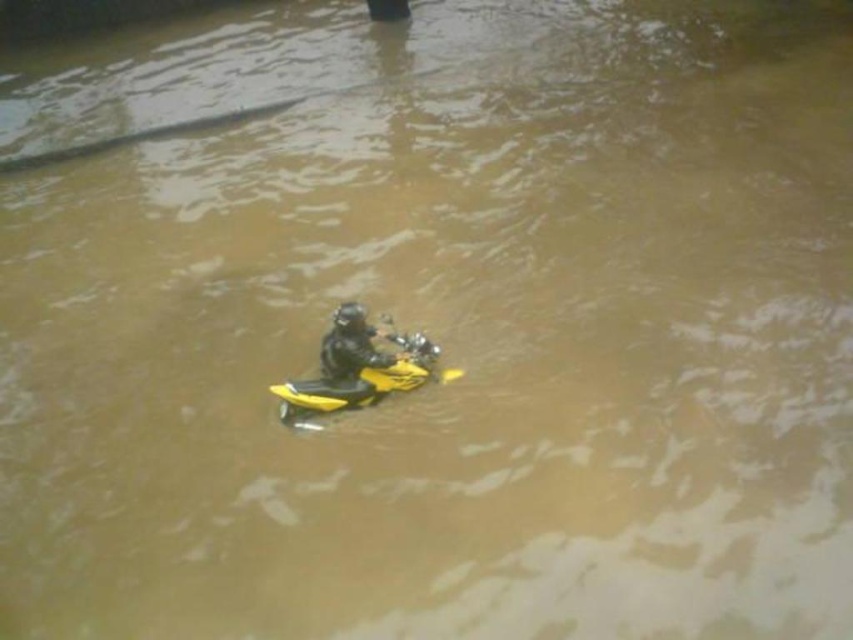
Question: Is the position of yellow matte motorcycle at center less distant than that of black matte helmet at center?

Choices:
 (A) yes
 (B) no

Answer: (B)

Question: Does yellow matte motorcycle at center appear on the right side of black matte helmet at center?

Choices:
 (A) yes
 (B) no

Answer: (A)

Question: Which point is closer to the camera?

Choices:
 (A) (379, 358)
 (B) (318, 394)

Answer: (B)

Question: Among these objects, which one is nearest to the camera?

Choices:
 (A) yellow matte motorcycle at center
 (B) black matte helmet at center

Answer: (B)

Question: Is yellow matte motorcycle at center above black matte helmet at center?

Choices:
 (A) yes
 (B) no

Answer: (B)